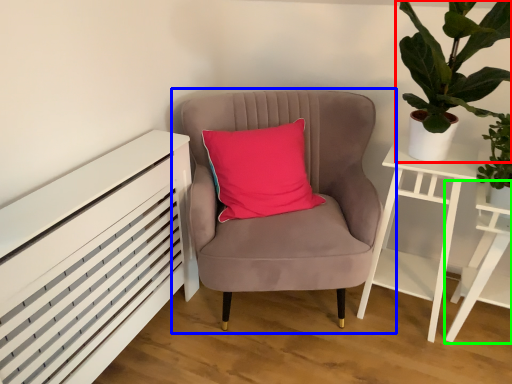
Question: Which object is the farthest from houseplant (highlighted by a red box)? Choose among these: chair (highlighted by a blue box) or table (highlighted by a green box).

Choices:
 (A) chair
 (B) table

Answer: (B)